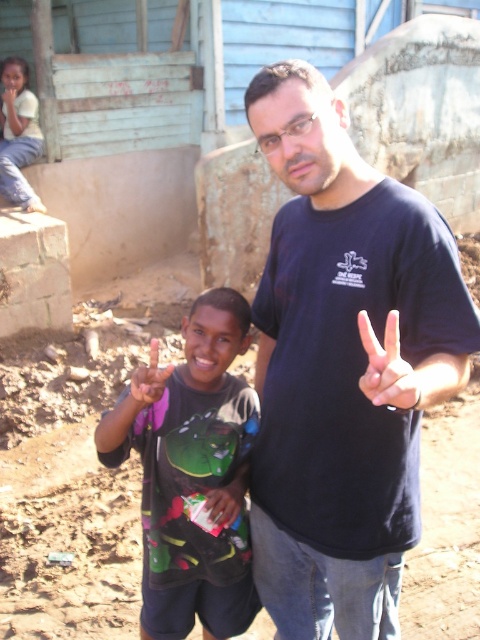
Which of these two, matte black hand at center or pink fabric at center, stands taller?

With more height is pink fabric at center.

Is point (369, 392) positioned before point (147, 365)?

Yes, it is in front of point (147, 365).

Is point (379, 400) closer to camera compared to point (162, 394)?

Yes, point (379, 400) is closer to viewer.

Locate an element on the screen. The height and width of the screenshot is (640, 480). matte black hand at center is located at coordinates [x=388, y=368].

Can you confirm if dark blue t-shirt at center is thinner than pink fabric at center?

In fact, dark blue t-shirt at center might be wider than pink fabric at center.

Does dark blue t-shirt at center have a smaller size compared to pink fabric at center?

No, dark blue t-shirt at center is not smaller than pink fabric at center.

Which is in front, point (300, 307) or point (146, 365)?

Point (300, 307)

This screenshot has width=480, height=640. I want to click on dark blue t-shirt at center, so click(x=340, y=365).

Is point (394, 372) positioned before point (211, 492)?

Yes, point (394, 372) is closer to viewer.

You are a GUI agent. You are given a task and a screenshot of the screen. Output one action in this format:
    pyautogui.click(x=<x>, y=<y>)
    Task: Click on the matte black hand at center
    
    Given the screenshot: What is the action you would take?
    pyautogui.click(x=388, y=368)

Where is `matte black hand at center`? matte black hand at center is located at coordinates (388, 368).